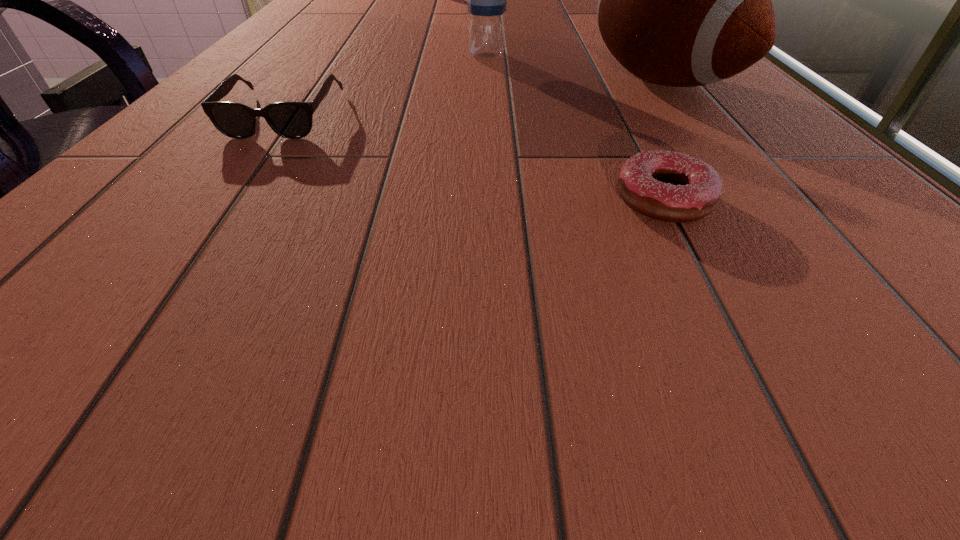
At what (x,y) coordinates should I click in order to perform the action: click on free space located on the label of the third object from right to left. Please return your answer as a coordinate pair (x, y). Image resolution: width=960 pixels, height=540 pixels. Looking at the image, I should click on (500, 160).

You are a GUI agent. You are given a task and a screenshot of the screen. Output one action in this format:
    pyautogui.click(x=<x>, y=<y>)
    Task: Click on the blank space located on the laces of the football
    Image resolution: width=960 pixels, height=540 pixels.
    Given the screenshot: What is the action you would take?
    pyautogui.click(x=588, y=104)

Find the location of a particular element. Image resolution: width=960 pixels, height=540 pixels. free location located on the laces of the football is located at coordinates (385, 156).

The image size is (960, 540). I want to click on blank space located on the laces of the football, so click(459, 137).

Locate an element on the screen. object at the near edge is located at coordinates (668, 186).

You are a GUI agent. You are given a task and a screenshot of the screen. Output one action in this format:
    pyautogui.click(x=<x>, y=<y>)
    Task: Click on the object at the left edge
    The height and width of the screenshot is (540, 960).
    Given the screenshot: What is the action you would take?
    pyautogui.click(x=293, y=120)

Locate an element on the screen. This screenshot has width=960, height=540. object that is at the right edge is located at coordinates (684, 0).

Locate an element on the screen. free space at the left edge of the desktop is located at coordinates (325, 56).

The width and height of the screenshot is (960, 540). Identify the location of vacant space at the right edge. (748, 170).

Image resolution: width=960 pixels, height=540 pixels. In order to click on vacant space that's between the shortest object and the football in this screenshot , I will do `click(661, 140)`.